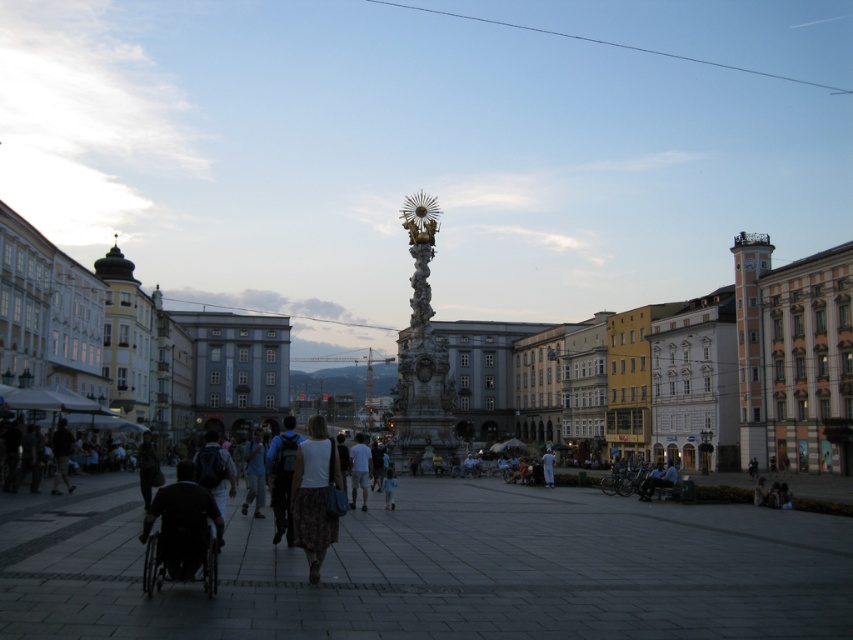
Question: Can you confirm if light blue denim jeans at center is positioned to the right of light gray cotton shorts at center?

Choices:
 (A) no
 (B) yes

Answer: (A)

Question: Which of these objects is positioned farthest from the white fabric person at center?

Choices:
 (A) white fabric dress at center
 (B) dark gray fabric jacket at lower left
 (C) light brown fabric pants at center

Answer: (A)

Question: Estimate the real-world distances between objects in this image. Which object is farther from the light blue denim jeans at center?

Choices:
 (A) light brown fabric pants at center
 (B) light gray cotton shorts at center
 (C) dark blue backpack at center

Answer: (A)

Question: Is light gray cotton shorts at center above light brown fabric pants at center?

Choices:
 (A) no
 (B) yes

Answer: (A)

Question: Observing the image, what is the correct spatial positioning of light blue denim jeans at center in reference to light gray cotton shorts at center?

Choices:
 (A) below
 (B) above

Answer: (B)

Question: Estimate the real-world distances between objects in this image. Which object is farther from the dark gray plastic wheelchair at lower left?

Choices:
 (A) light brown fabric pants at center
 (B) white fabric person at center
 (C) polished stone column at center
 (D) dark blue backpack at center

Answer: (B)